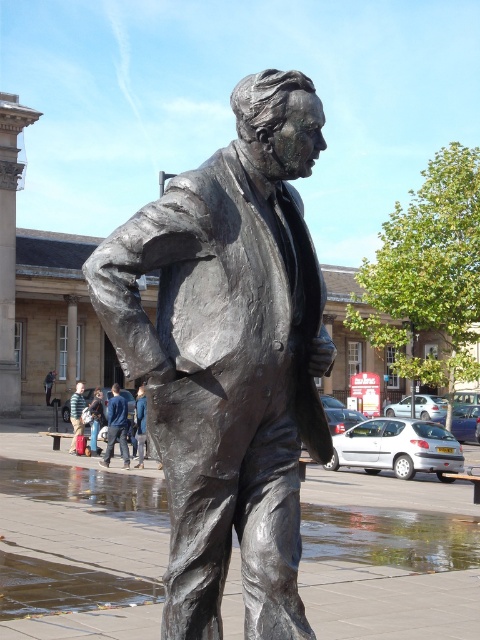
Question: Is blue denim jeans at center thinner than matte black jacket at center?

Choices:
 (A) no
 (B) yes

Answer: (B)

Question: Can you confirm if blue denim jeans at center is smaller than matte black jacket at center?

Choices:
 (A) yes
 (B) no

Answer: (A)

Question: Which point is farther from the camera taking this photo?

Choices:
 (A) (109, 451)
 (B) (75, 413)

Answer: (B)

Question: Among these points, which one is nearest to the camera?

Choices:
 (A) (194, 442)
 (B) (122, 429)

Answer: (A)

Question: Which object appears farthest from the camera in this image?

Choices:
 (A) matte black jacket at center
 (B) bronze statue at center

Answer: (A)

Question: From the image, what is the correct spatial relationship of bronze statue at center in relation to matte black jacket at center?

Choices:
 (A) left
 (B) right

Answer: (B)